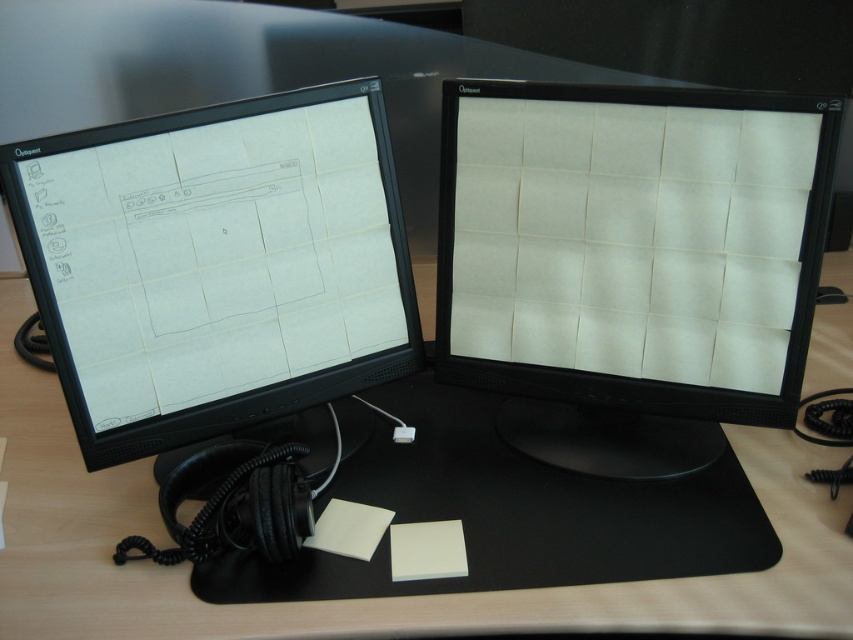
Question: Which object appears closest to the camera in this image?

Choices:
 (A) matte black monitor at left
 (B) white matte computer monitor at center

Answer: (A)

Question: Which point is farther from the camera taking this photo?

Choices:
 (A) (453, 252)
 (B) (161, 570)
 (C) (320, 100)

Answer: (A)

Question: Is the position of matte black monitor at left more distant than that of wooden table at center?

Choices:
 (A) no
 (B) yes

Answer: (B)

Question: Can you confirm if white matte computer monitor at center is positioned to the left of wooden table at center?

Choices:
 (A) yes
 (B) no

Answer: (B)

Question: Is matte black monitor at left wider than wooden table at center?

Choices:
 (A) no
 (B) yes

Answer: (A)

Question: Estimate the real-world distances between objects in this image. Which object is farther from the wooden table at center?

Choices:
 (A) white matte computer monitor at center
 (B) matte black monitor at left

Answer: (B)